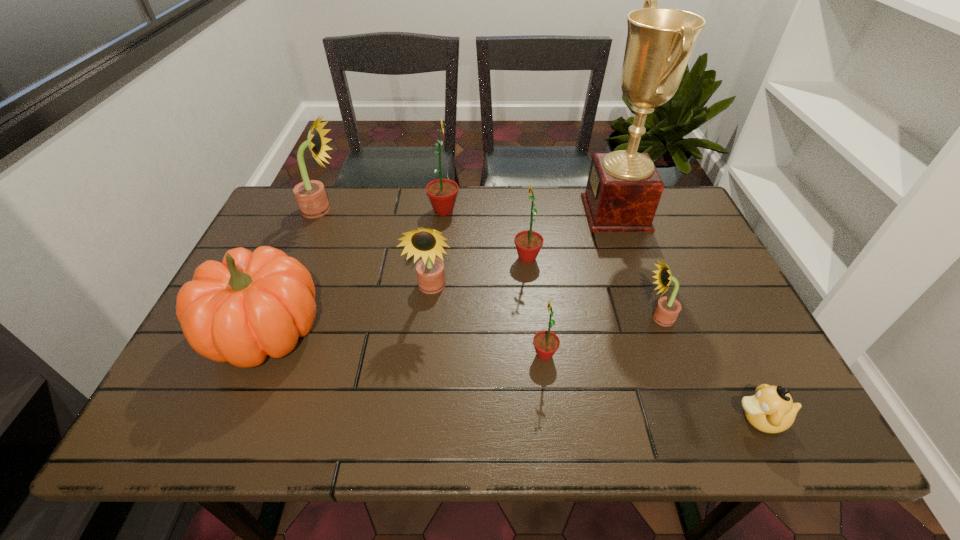
The width and height of the screenshot is (960, 540). Identify the location of sunflower that is the fourth nearest to the biggest yellow sunflower. (546, 343).

Where is `sunflower that is the sixth closest to the tan duckling`? The image size is (960, 540). sunflower that is the sixth closest to the tan duckling is located at coordinates (x=310, y=195).

Point out which yellow sunflower is positioned as the second nearest to the second yellow sunflower from left to right. Please provide its 2D coordinates. Your answer should be formatted as a tuple, i.e. [(x, y)], where the tuple contains the x and y coordinates of a point satisfying the conditions above.

[(667, 309)]

Locate an element on the screen. The width and height of the screenshot is (960, 540). yellow sunflower identified as the second closest to the second farthest green sunflower is located at coordinates (667, 309).

Where is `the third closest green sunflower to the tan duckling`? the third closest green sunflower to the tan duckling is located at coordinates (442, 193).

Where is `green sunflower that is the closest to the tan duckling`? green sunflower that is the closest to the tan duckling is located at coordinates (546, 343).